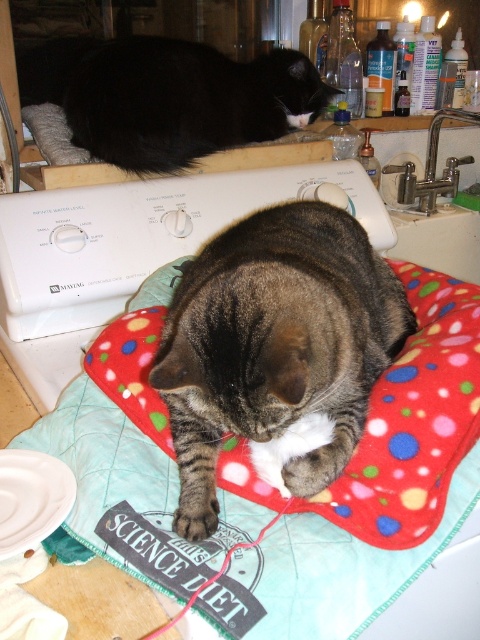
Describe the element at coordinates (132, 492) in the screenshot. The height and width of the screenshot is (640, 480). I see `polka dot fleece pillow at center` at that location.

Between point (157, 497) and point (97, 129), which one is positioned in front?

Point (157, 497) is more forward.

Identify the location of polka dot fleece pillow at center. The image size is (480, 640). (132, 492).

Does point (300, 458) lie behind point (190, 122)?

No, it is in front of (190, 122).

Is tabby fur cat at center above black fur cat at upper left?

No, tabby fur cat at center is not above black fur cat at upper left.

Is point (264, 349) closer to viewer compared to point (187, 52)?

Yes, point (264, 349) is closer to viewer.

You are a GUI agent. You are given a task and a screenshot of the screen. Output one action in this format:
    pyautogui.click(x=<x>, y=<y>)
    Task: Click on the tabby fur cat at center
    The height and width of the screenshot is (640, 480).
    Given the screenshot: What is the action you would take?
    pyautogui.click(x=276, y=346)

Is white plastic sewing machine at upper center smaller than black fur cat at upper left?

No, white plastic sewing machine at upper center is not smaller than black fur cat at upper left.

The height and width of the screenshot is (640, 480). What do you see at coordinates (131, 250) in the screenshot?
I see `white plastic sewing machine at upper center` at bounding box center [131, 250].

I want to click on white plastic sewing machine at upper center, so click(131, 250).